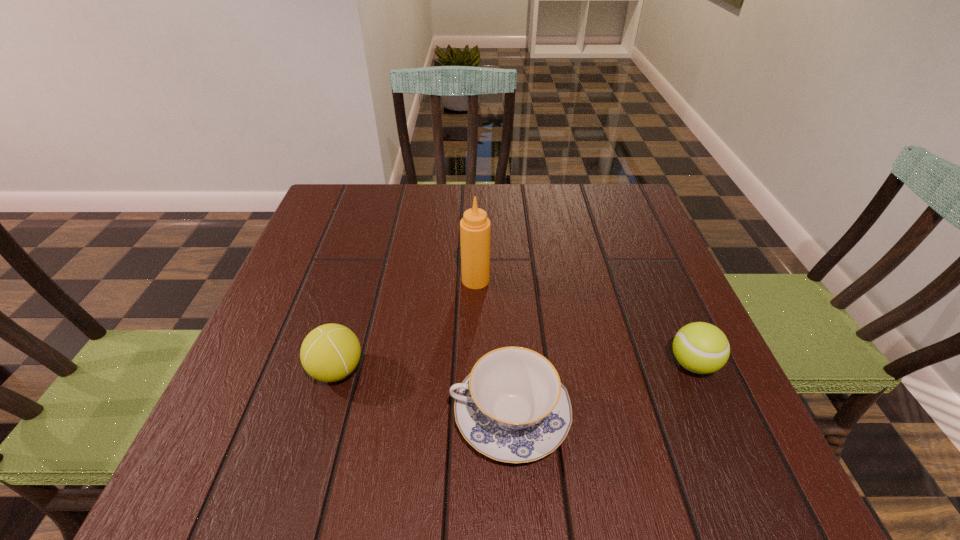
The image size is (960, 540). Identify the location of vacant area that lies between the tallest object and the rightmost object. (585, 322).

Find the location of a particular element. This screenshot has height=540, width=960. free spot between the condiment and the right tennis ball is located at coordinates (585, 322).

Find the location of a particular element. free point between the right tennis ball and the chinaware is located at coordinates (601, 389).

The height and width of the screenshot is (540, 960). Find the location of `empty space between the left tennis ball and the tallest object`. empty space between the left tennis ball and the tallest object is located at coordinates (406, 325).

Where is `vacant point located between the chinaware and the right tennis ball`? vacant point located between the chinaware and the right tennis ball is located at coordinates (601, 389).

Find the location of `free space between the left tennis ball and the condiment`. free space between the left tennis ball and the condiment is located at coordinates (406, 325).

The height and width of the screenshot is (540, 960). What are the coordinates of `vacant region between the right tennis ball and the chinaware` in the screenshot? It's located at (601, 389).

Identify which object is the second nearest to the chinaware. Please provide its 2D coordinates. Your answer should be formatted as a tuple, i.e. [(x, y)], where the tuple contains the x and y coordinates of a point satisfying the conditions above.

[(702, 348)]

Identify which object is the third nearest to the condiment. Please provide its 2D coordinates. Your answer should be formatted as a tuple, i.e. [(x, y)], where the tuple contains the x and y coordinates of a point satisfying the conditions above.

[(702, 348)]

Where is `vacant space that satisfies the following two spatial constraints: 1. with the handle on the side of the right tennis ball; 2. on the right side of the chinaware`? vacant space that satisfies the following two spatial constraints: 1. with the handle on the side of the right tennis ball; 2. on the right side of the chinaware is located at coordinates (507, 364).